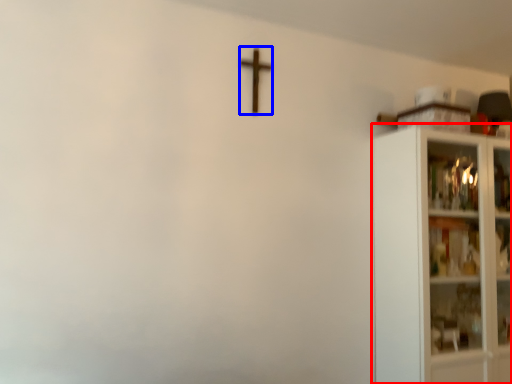
Question: Which of the following is the farthest to the observer, shelf (highlighted by a red box) or crucifix (highlighted by a blue box)?

Choices:
 (A) shelf
 (B) crucifix

Answer: (B)